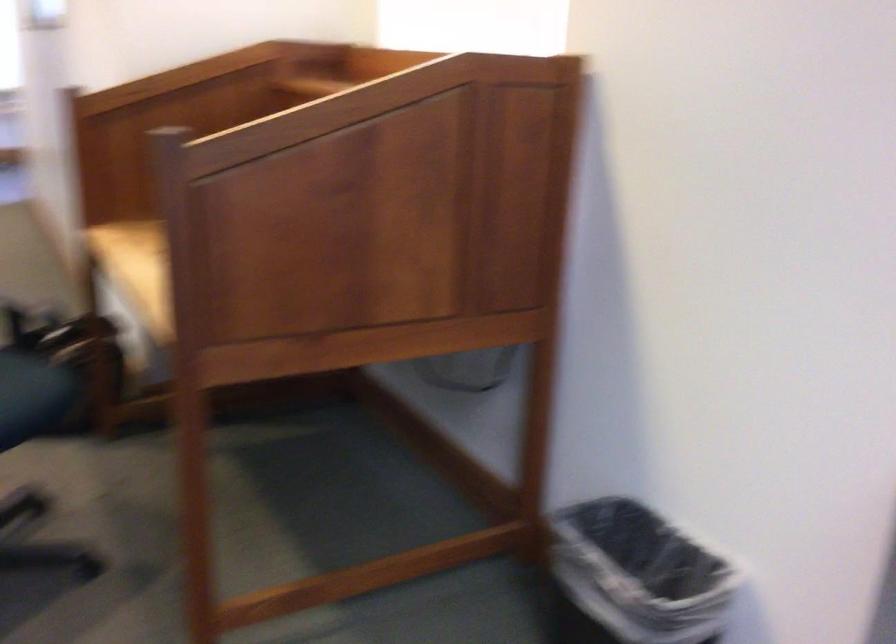
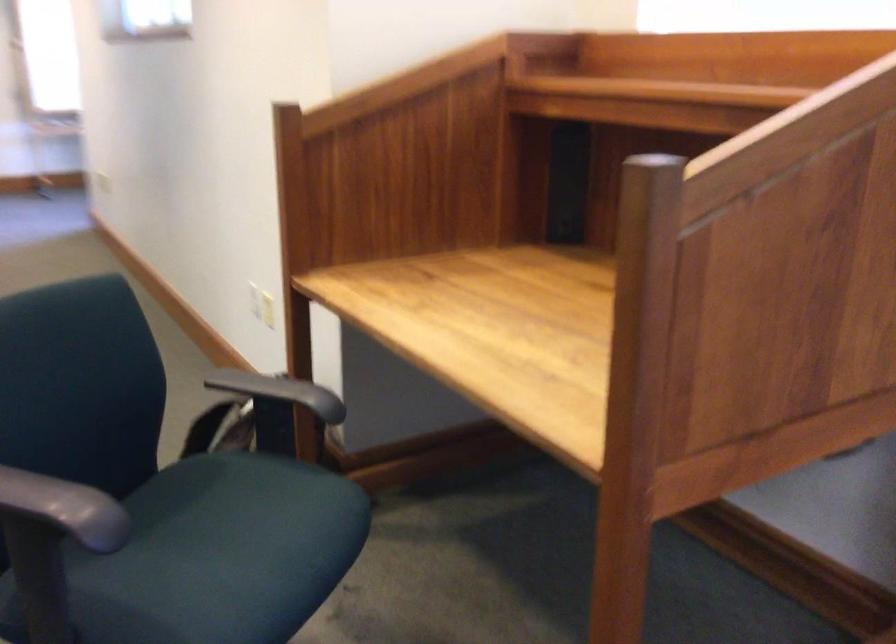
Which direction would the cameraman need to move to produce the second image?

The cameraman walked toward left, forward.